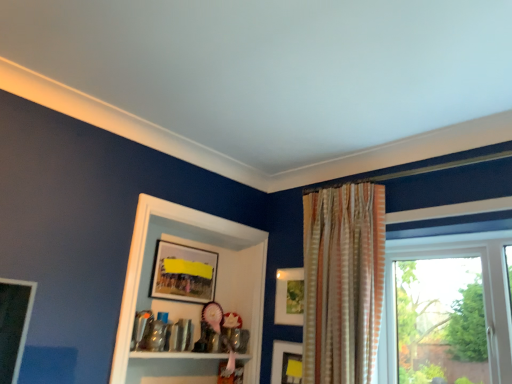
Question: In terms of size, does matte yellow picture frame at lower right, the 4th picture frame positioned from the left, appear bigger or smaller than matte wooden picture frame at upper center, which is the first picture frame in left-to-right order?

Choices:
 (A) small
 (B) big

Answer: (A)

Question: From a real-world perspective, relative to matte wooden picture frame at upper center, which is the 4th picture frame from right to left, is matte yellow picture frame at lower right, the 4th picture frame positioned from the left, vertically above or below?

Choices:
 (A) below
 (B) above

Answer: (A)

Question: Estimate the real-world distances between objects in this image. Which object is closer to the matte white picture frame at center, placed as the second picture frame when sorted from right to left?

Choices:
 (A) matte yellow picture frame at lower right, the 4th picture frame positioned from the left
 (B) wooden picture frame at center, placed as the 3th picture frame when sorted from right to left
 (C) white glossy cabinet at center
 (D) matte wooden picture frame at upper center, which is the 4th picture frame from right to left
 (E) striped fabric curtain at upper right

Answer: (B)

Question: Which object is the closest to the matte wooden picture frame at upper center, which is the 4th picture frame from right to left?

Choices:
 (A) wooden picture frame at center, placed as the 2th picture frame when sorted from left to right
 (B) white glossy cabinet at center
 (C) striped fabric curtain at upper right
 (D) matte yellow picture frame at lower right, the 4th picture frame positioned from the left
 (E) matte white picture frame at center, the third picture frame from the left

Answer: (B)